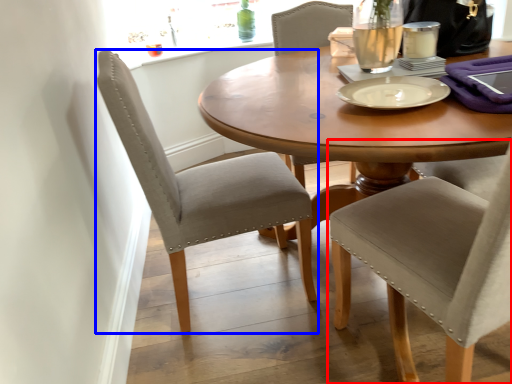
Question: Which object appears closest to the camera in this image, chair (highlighted by a red box) or chair (highlighted by a blue box)?

Choices:
 (A) chair
 (B) chair

Answer: (A)